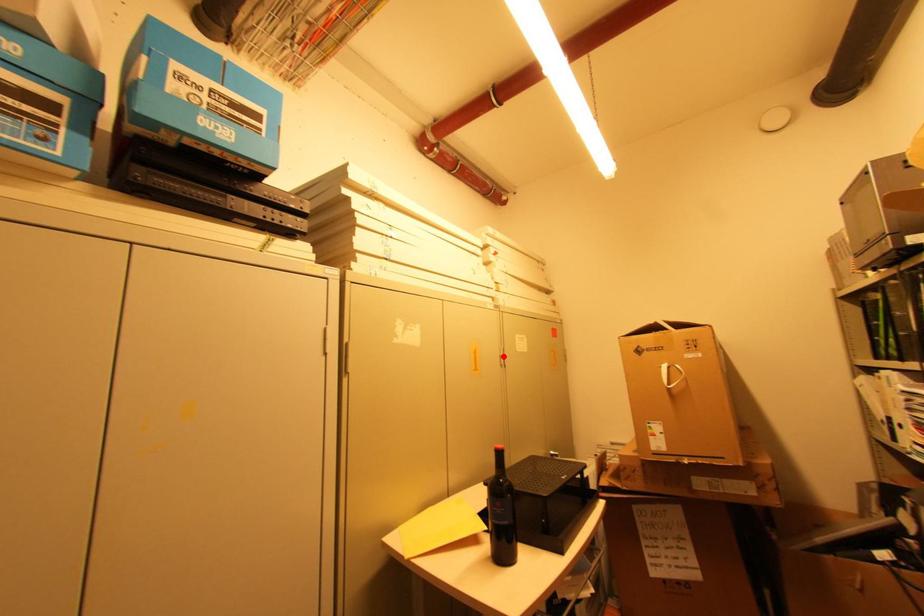
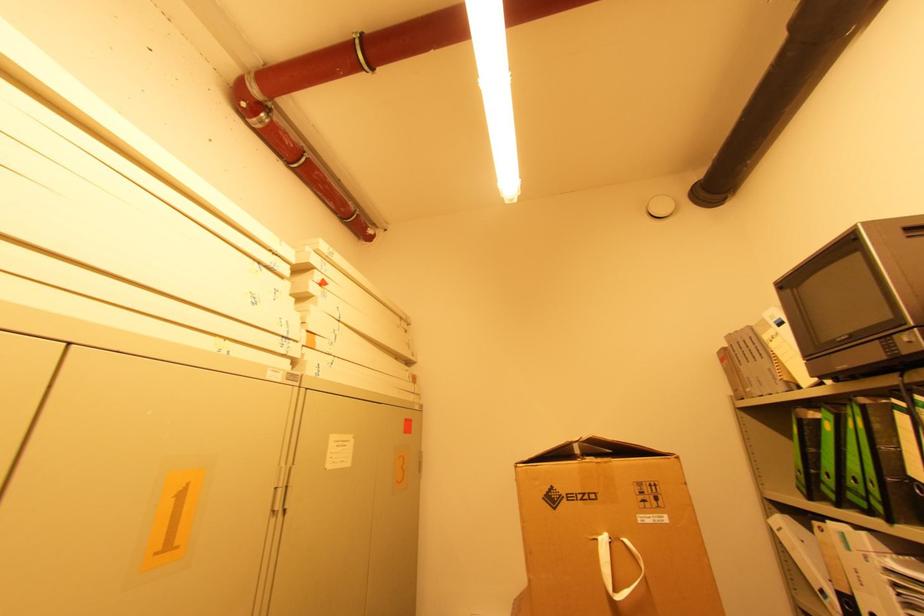
Where in the second image is the point corresponding to the highlighted location from the first image?

(280, 488)